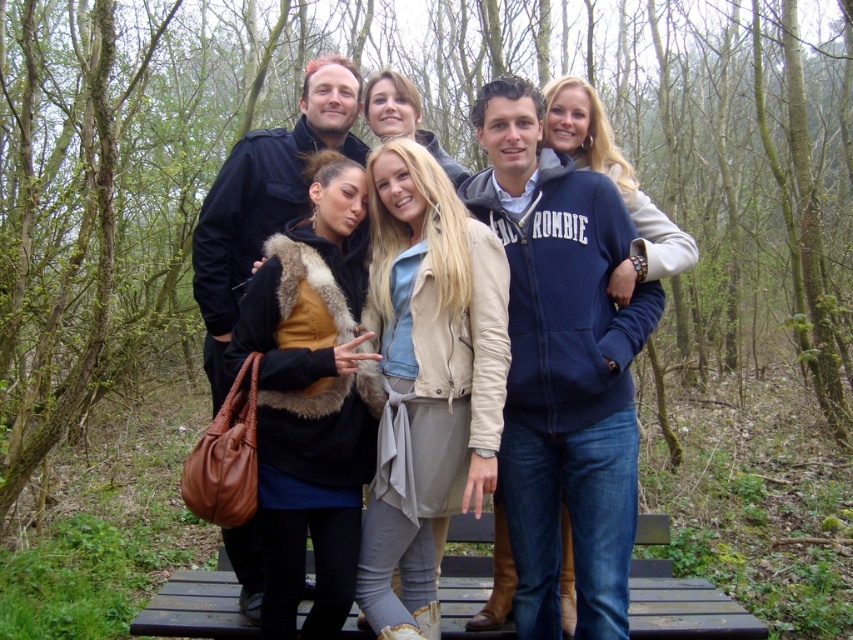
Is matte black jacket at center further to camera compared to black wood bench at center?

Yes, matte black jacket at center is behind black wood bench at center.

Is point (213, 280) closer to camera compared to point (447, 608)?

No, (213, 280) is further to viewer.

Who is more forward, (215, 253) or (445, 589)?

Point (215, 253) is more forward.

I want to click on matte black jacket at center, so click(287, 186).